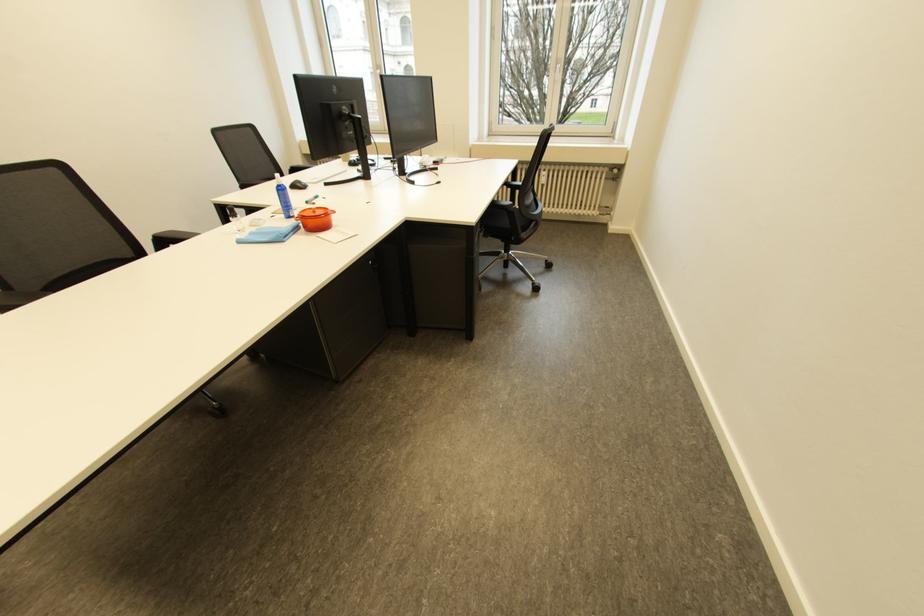
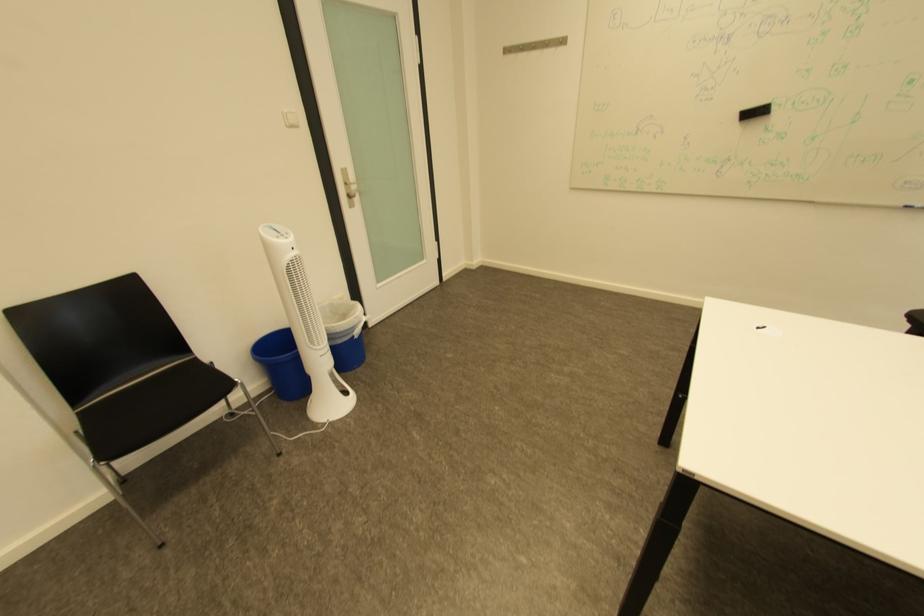
The images are taken continuously from a first-person perspective. In which direction is your viewpoint rotating?

The camera rotated toward left-down.